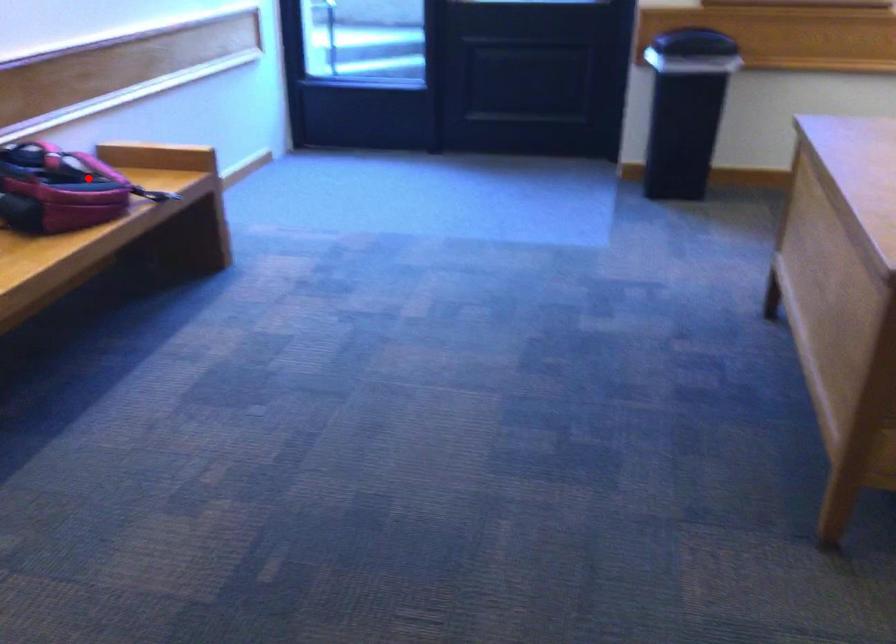
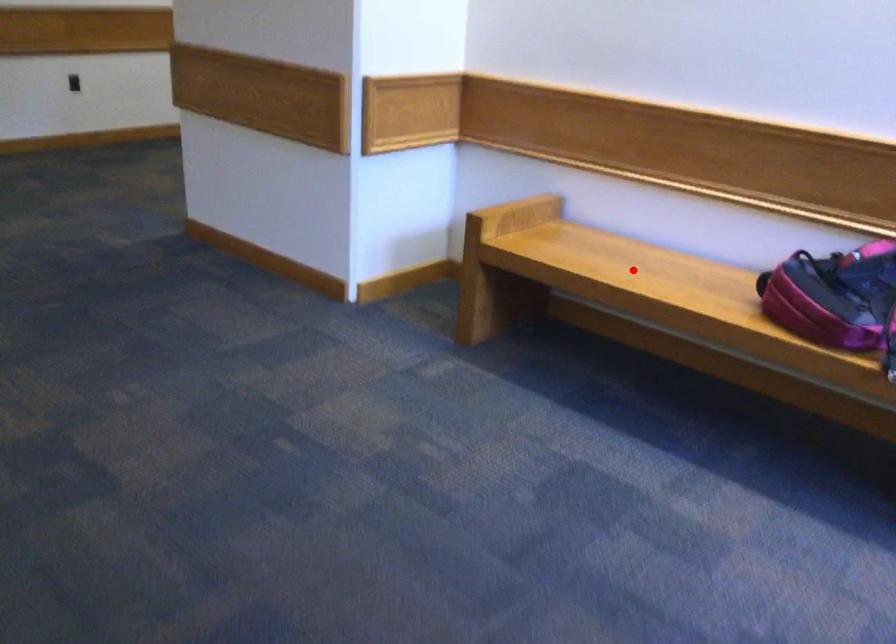
I am providing you with two images of the same scene from different viewpoints. A red point is marked on the first image and another point is marked on the second image. Are the points marked in image1 and image2 representing the same 3D position?

No